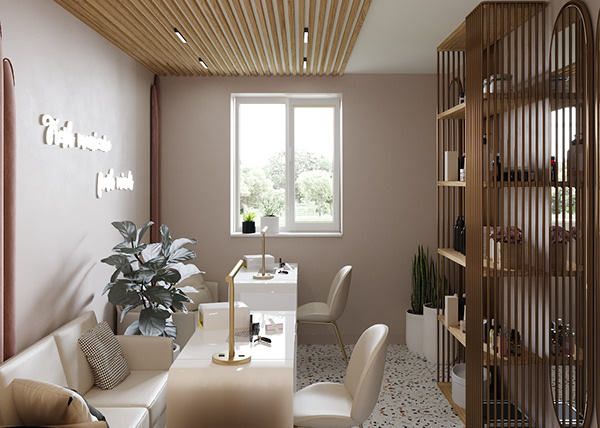
This screenshot has height=428, width=600. Identify the location of throw pillow. click(193, 281), click(107, 345), click(93, 411).